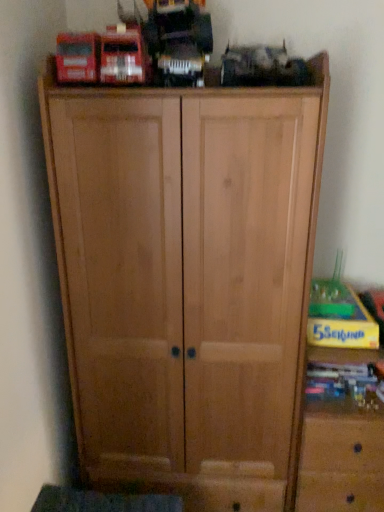
At what (x,y) coordinates should I click in order to perform the action: click on wooden side cabinet at right. Please return your answer as a coordinate pair (x, y). Looking at the image, I should click on (341, 433).

What do you see at coordinates (341, 433) in the screenshot?
I see `wooden side cabinet at right` at bounding box center [341, 433].

What is the approximate width of wooden side cabinet at right?

wooden side cabinet at right is 17.96 inches wide.

Identify the location of wooden side cabinet at right. The height and width of the screenshot is (512, 384). pos(341,433).